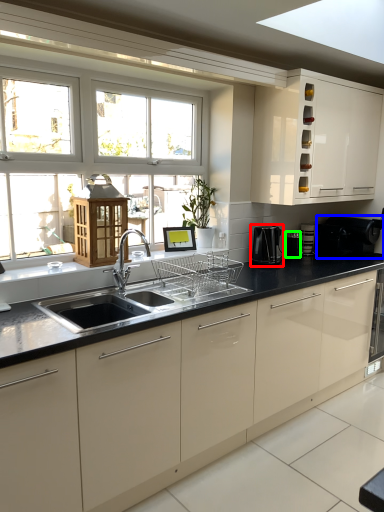
Question: Estimate the real-world distances between objects in this image. Which object is farther from coffee machine (highlighted by a red box), appliance (highlighted by a blue box) or appliance (highlighted by a green box)?

Choices:
 (A) appliance
 (B) appliance

Answer: (A)